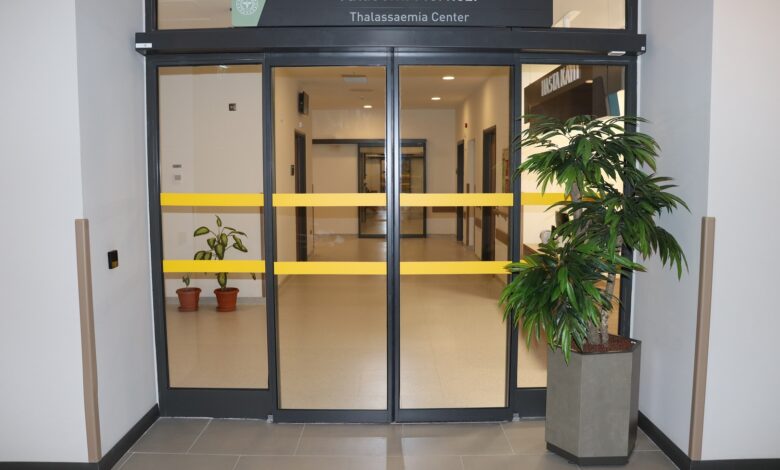
I want to click on line where the doors meet, so click(x=392, y=237).